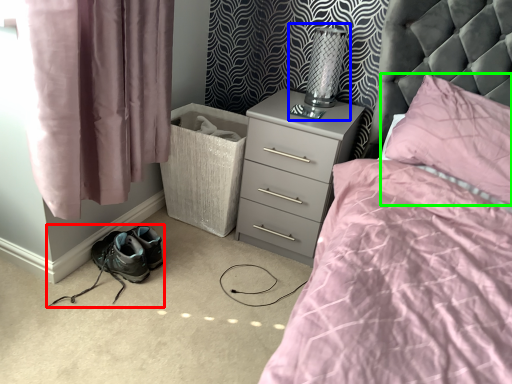
Question: Which is farther away from footwear (highlighted by a red box)? table lamp (highlighted by a blue box) or pillow (highlighted by a green box)?

Choices:
 (A) table lamp
 (B) pillow

Answer: (B)